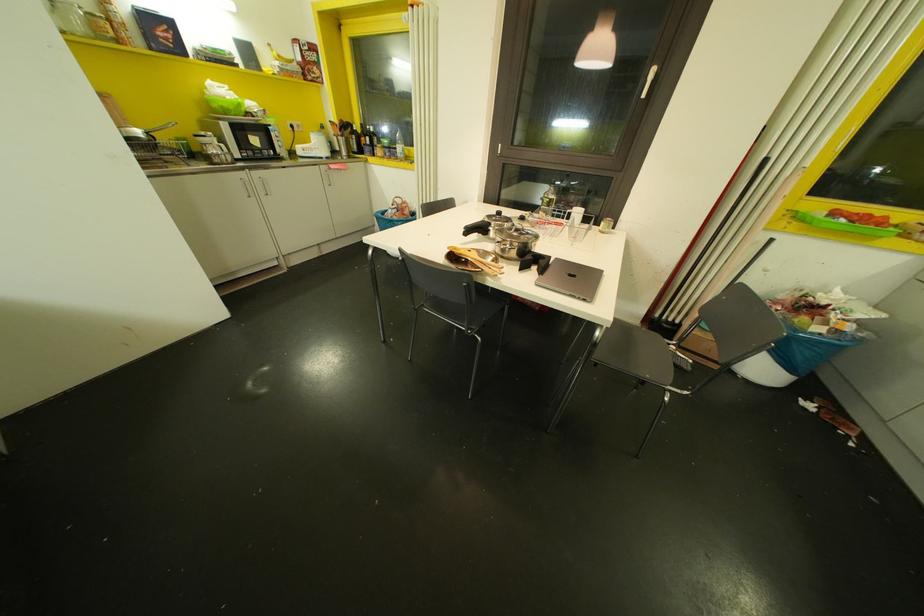
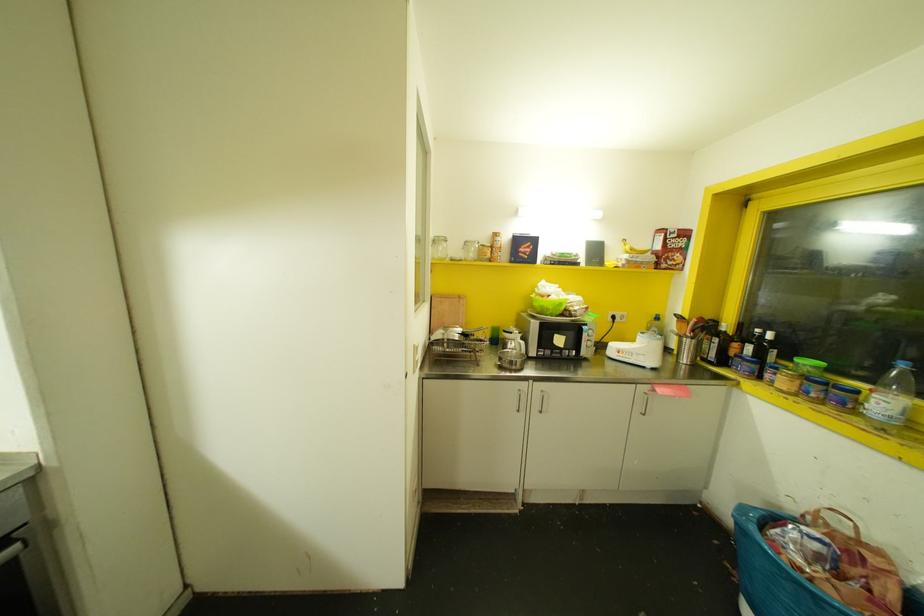
In the second image, find the point that corresponds to point 385,209 in the first image.

(773, 517)